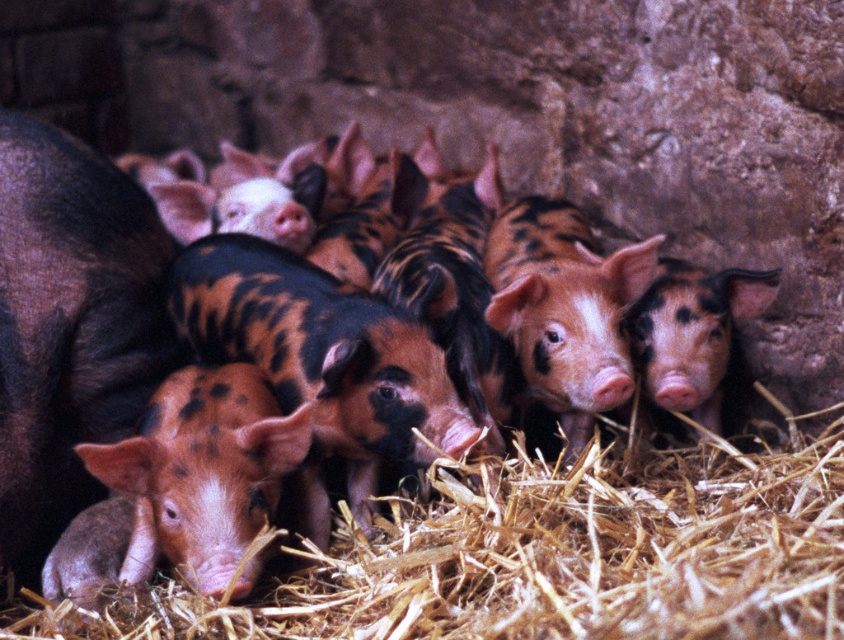
Between brown straw at lower left and spotted pink piglet at center, which one appears on the left side from the viewer's perspective?

spotted pink piglet at center

Does brown straw at lower left come behind spotted pink piglet at center?

No, it is in front of spotted pink piglet at center.

Locate an element on the screen. The width and height of the screenshot is (844, 640). brown straw at lower left is located at coordinates (545, 556).